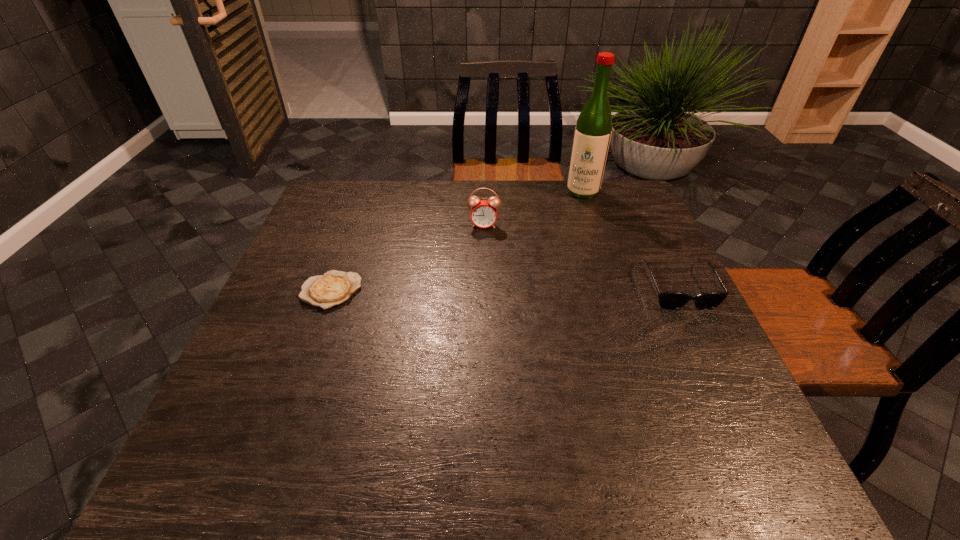
Identify the location of object that stands as the closest to the leftmost object. (484, 213).

The image size is (960, 540). I want to click on free space that satisfies the following two spatial constraints: 1. on the back side of the quiche; 2. on the left side of the second object from right to left, so click(368, 192).